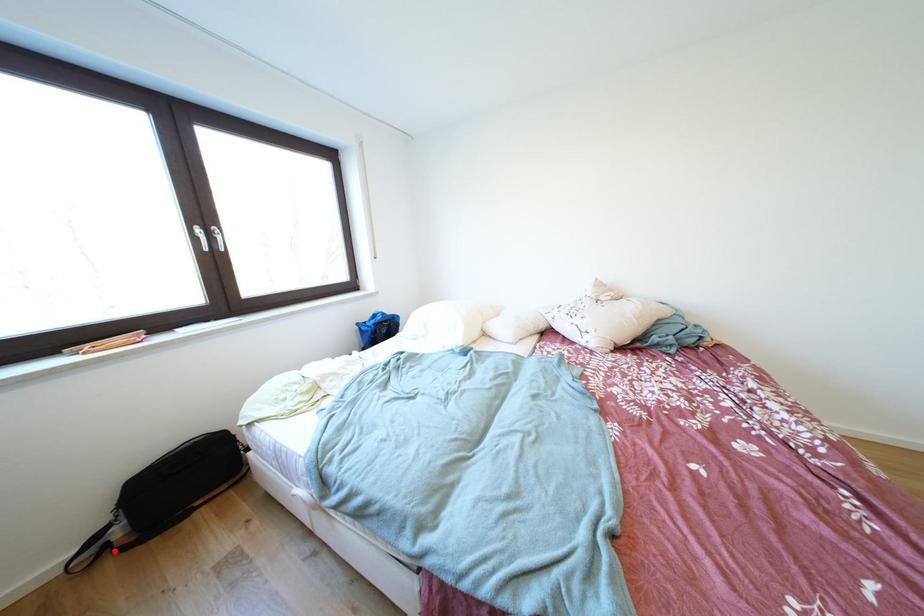
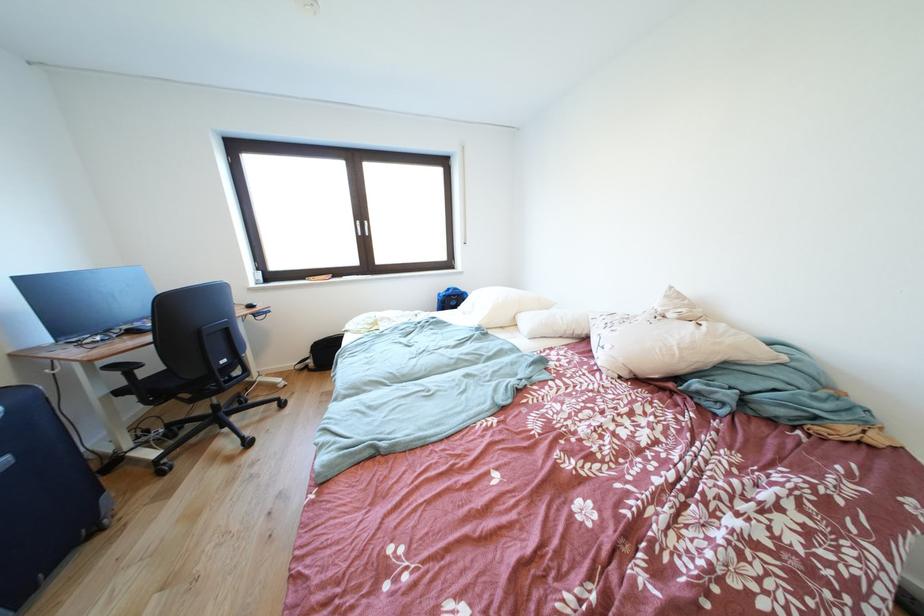
Question: I am providing you with two images of the same scene from different viewpoints. A red point is shown in image1. For the corresponding object point in image2, is it positioned nearer or farther from the camera?

Choices:
 (A) Nearer
 (B) Farther

Answer: (B)